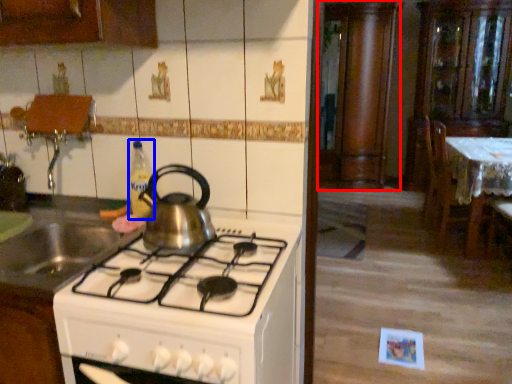
Question: Which object appears closest to the camera in this image, cabinetry (highlighted by a red box) or bottle (highlighted by a blue box)?

Choices:
 (A) cabinetry
 (B) bottle

Answer: (B)